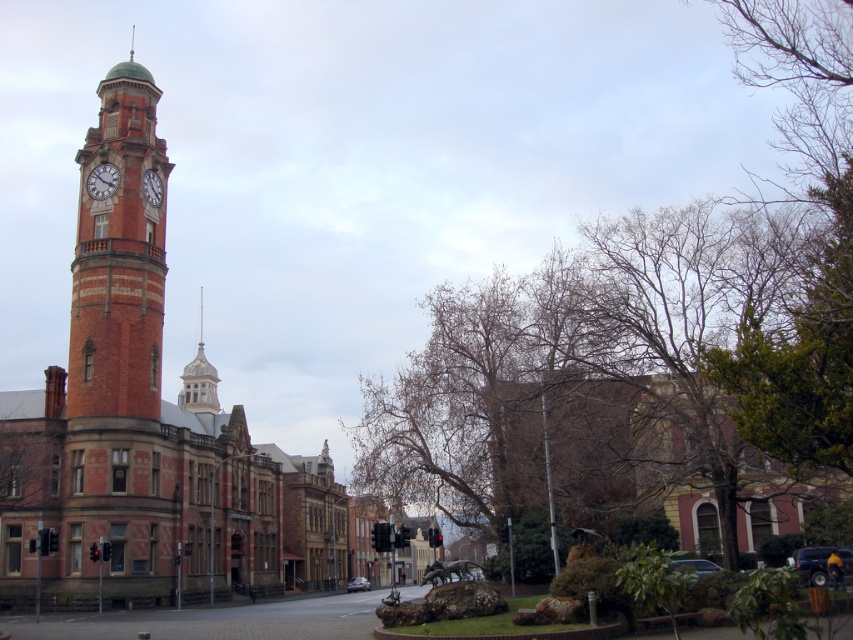
Question: Which point is farther to the camera?

Choices:
 (A) matte brick clock at left
 (B) brick clock tower at left

Answer: (A)

Question: Can you confirm if matte brick clock tower at left is smaller than matte brick clock at left?

Choices:
 (A) no
 (B) yes

Answer: (B)

Question: Which point appears farthest from the camera in this image?

Choices:
 (A) (94, 195)
 (B) (119, 141)

Answer: (B)

Question: Is brick clock tower at left wider than matte brick clock at left?

Choices:
 (A) yes
 (B) no

Answer: (A)

Question: Observing the image, what is the correct spatial positioning of brick clock tower at left in reference to matte brick clock tower at left?

Choices:
 (A) right
 (B) left

Answer: (A)

Question: Which of the following is the farthest from the observer?

Choices:
 (A) matte brick clock tower at left
 (B) matte brick clock at left
 (C) brick clock tower at left

Answer: (A)